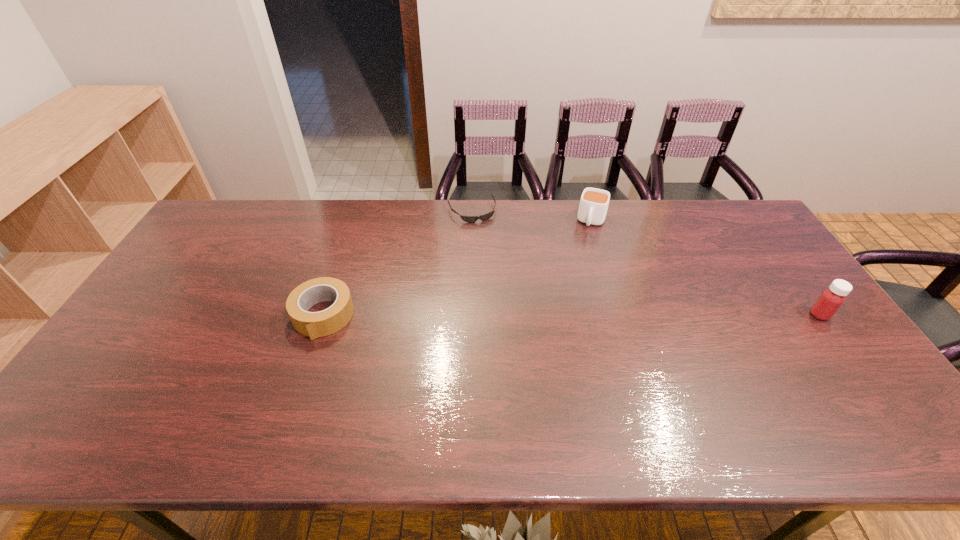
Locate an element on the screen. free spot between the third shortest object and the third object from right to left is located at coordinates (532, 216).

Find the location of a particular element. This screenshot has width=960, height=540. free space that is in between the sunglasses and the leftmost object is located at coordinates (397, 264).

The width and height of the screenshot is (960, 540). I want to click on free space between the cup and the tallest object, so click(706, 268).

Identify the location of blank region between the cup and the second shortest object. (458, 268).

Where is `vacant space that is in between the second object from right to left and the sunglasses`? vacant space that is in between the second object from right to left and the sunglasses is located at coordinates (532, 216).

I want to click on the closest object to the third object from left to right, so click(470, 219).

What are the coordinates of `object that is the closest one to the tallest object` in the screenshot? It's located at (593, 206).

This screenshot has height=540, width=960. I want to click on blank area in the image that satisfies the following two spatial constraints: 1. on the front side of the rightmost object; 2. on the left side of the third shortest object, so click(620, 315).